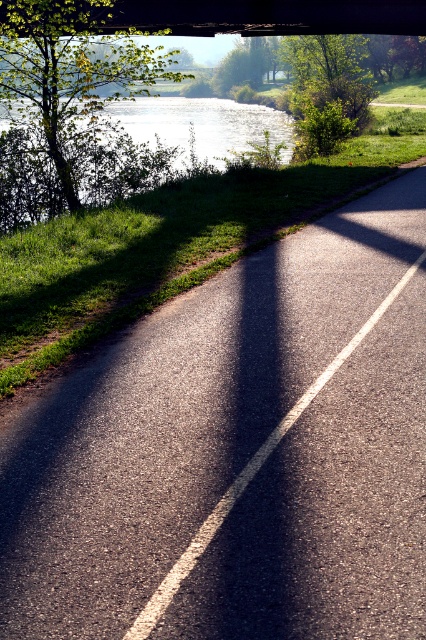
Question: Is glistening water at upper left further to camera compared to concrete bridge at upper center?

Choices:
 (A) no
 (B) yes

Answer: (A)

Question: Among these objects, which one is nearest to the camera?

Choices:
 (A) concrete bridge at upper center
 (B) asphalt at center
 (C) glistening water at upper left

Answer: (B)

Question: Which object is the closest to the asphalt at center?

Choices:
 (A) concrete bridge at upper center
 (B) glistening water at upper left

Answer: (A)

Question: Which point appears farthest from the camera in this image?

Choices:
 (A) (143, 168)
 (B) (155, 336)
 (C) (118, 6)

Answer: (C)

Question: Is asphalt at center below concrete bridge at upper center?

Choices:
 (A) yes
 (B) no

Answer: (A)

Question: Does glistening water at upper left have a greater width compared to concrete bridge at upper center?

Choices:
 (A) yes
 (B) no

Answer: (A)